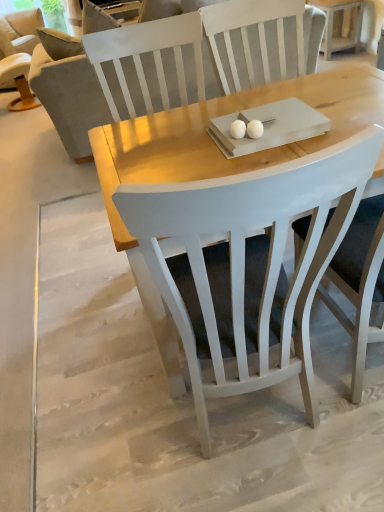
Question: From the image's perspective, is gray fabric couch at left beneath beige fabric chair at upper left, which ranks as the first chair in top-to-bottom order?

Choices:
 (A) yes
 (B) no

Answer: (A)

Question: From a real-world perspective, is gray fabric couch at left under beige fabric chair at upper left, placed as the second chair when sorted from front to back?

Choices:
 (A) yes
 (B) no

Answer: (B)

Question: Is gray fabric couch at left at the right side of beige fabric chair at upper left, which ranks as the first chair in top-to-bottom order?

Choices:
 (A) yes
 (B) no

Answer: (A)

Question: Is the depth of gray fabric couch at left greater than that of beige fabric chair at upper left, which ranks as the first chair in top-to-bottom order?

Choices:
 (A) no
 (B) yes

Answer: (A)

Question: Is beige fabric chair at upper left, which ranks as the first chair in top-to-bottom order, at the back of gray fabric couch at left?

Choices:
 (A) no
 (B) yes

Answer: (A)

Question: From a real-world perspective, is gray fabric couch at left located higher than beige fabric chair at upper left, which ranks as the first chair in top-to-bottom order?

Choices:
 (A) no
 (B) yes

Answer: (B)

Question: Is gray fabric couch at left positioned with its back to white wood chair at center, which is counted as the 2th chair, starting from the back?

Choices:
 (A) no
 (B) yes

Answer: (A)

Question: From the image's perspective, is gray fabric couch at left on top of white wood chair at center, the 1th chair from the right?

Choices:
 (A) yes
 (B) no

Answer: (A)

Question: From the image's perspective, does gray fabric couch at left appear lower than white wood chair at center, marked as the second chair in a left-to-right arrangement?

Choices:
 (A) yes
 (B) no

Answer: (B)

Question: Considering the relative sizes of gray fabric couch at left and white wood chair at center, acting as the 2th chair starting from the top, in the image provided, is gray fabric couch at left taller than white wood chair at center, acting as the 2th chair starting from the top,?

Choices:
 (A) no
 (B) yes

Answer: (A)

Question: Can you confirm if gray fabric couch at left is wider than white wood chair at center, acting as the 2th chair starting from the top?

Choices:
 (A) yes
 (B) no

Answer: (B)

Question: Is gray fabric couch at left beside white wood chair at center, marked as the second chair in a left-to-right arrangement?

Choices:
 (A) no
 (B) yes

Answer: (A)

Question: Considering the relative sizes of beige fabric chair at upper left, placed as the second chair when sorted from front to back, and white wood side table at upper right in the image provided, is beige fabric chair at upper left, placed as the second chair when sorted from front to back, shorter than white wood side table at upper right?

Choices:
 (A) no
 (B) yes

Answer: (A)